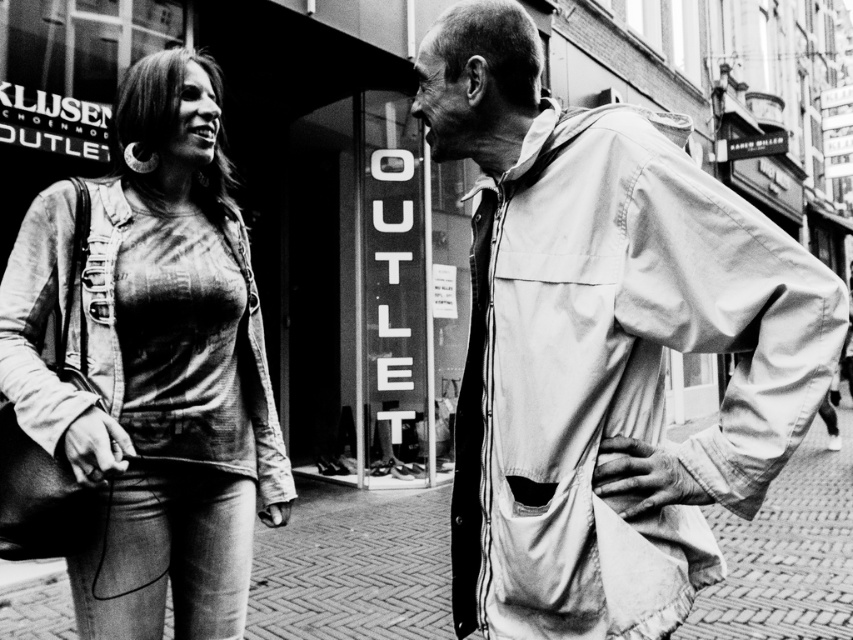
You are a photographer taking a picture of the two points in the image. Which point, point (466, 452) or point (674, 433), is closer to your camera lens?

Point (466, 452) is closer to the camera lens than point (674, 433).

In the scene described, there is a light beige fabric jacket at right located at point (602, 340). What is the exact coordinate of the light beige fabric jacket at right?

The light beige fabric jacket at right is located at point (602, 340).